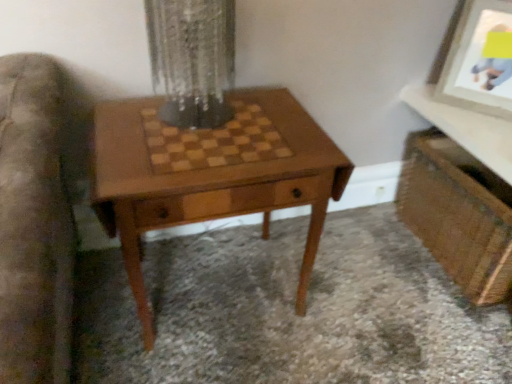
This screenshot has height=384, width=512. In order to click on vacant space to the right of clear glass vase at center in this screenshot , I will do point(270,126).